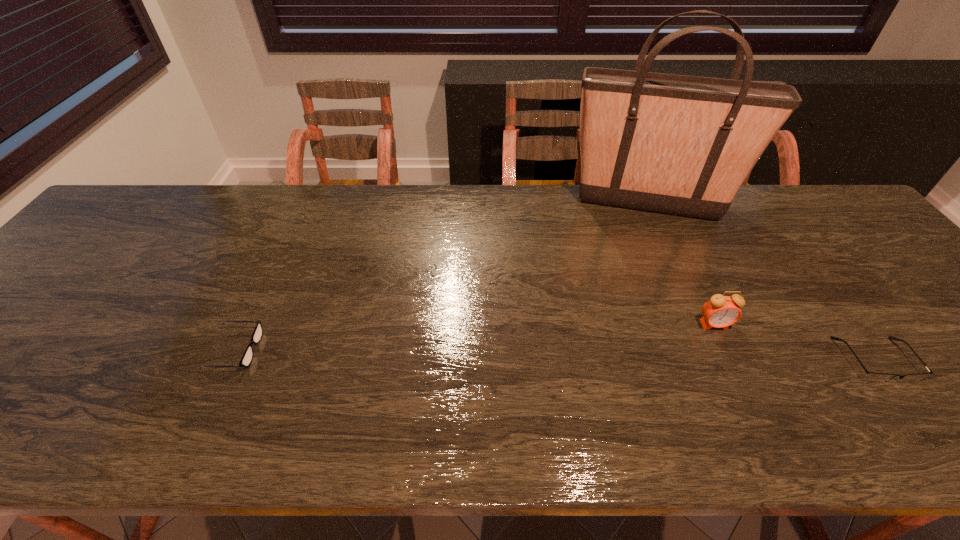
The width and height of the screenshot is (960, 540). In order to click on free space at the far edge of the desktop in this screenshot , I will do `click(540, 227)`.

Where is `vacant space at the near edge of the desktop`? vacant space at the near edge of the desktop is located at coordinates (352, 417).

I want to click on free spot at the left edge of the desktop, so click(48, 294).

Find the location of a particular element. free space at the right edge is located at coordinates (877, 313).

This screenshot has height=540, width=960. In the image, there is a desktop. What are the coordinates of `vacant region at the far left corner` in the screenshot? It's located at (132, 191).

Locate an element on the screen. This screenshot has width=960, height=540. vacant space at the far right corner of the desktop is located at coordinates (853, 215).

This screenshot has height=540, width=960. I want to click on free space between the shopping bag and the second tallest object, so click(681, 264).

Identify the location of empty space between the left spectacles and the tallest object. The image size is (960, 540). (442, 276).

This screenshot has width=960, height=540. What are the coordinates of `vacant space that's between the leftmost object and the alarm clock` in the screenshot? It's located at (475, 337).

The image size is (960, 540). I want to click on free space between the alarm clock and the leftmost object, so click(475, 337).